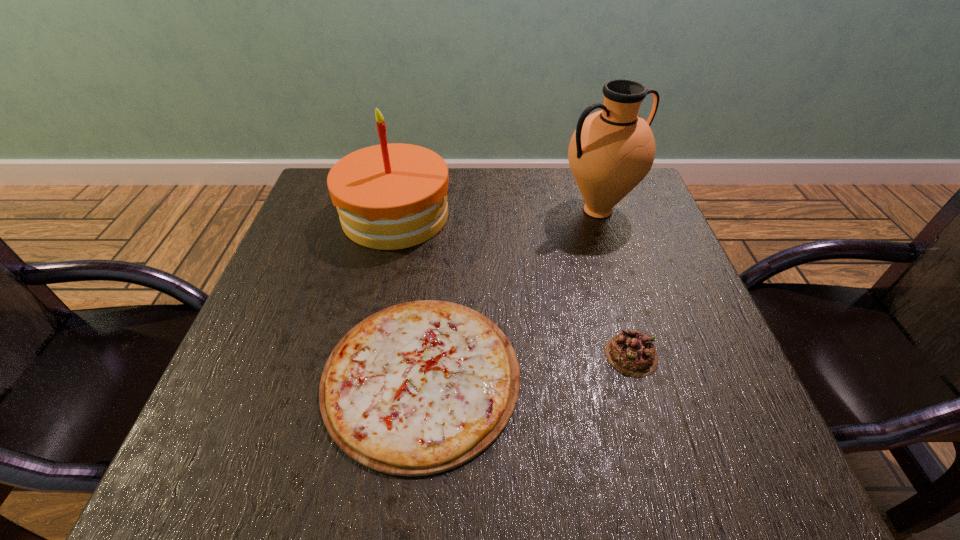
At what (x,y) coordinates should I click in order to perform the action: click on vacant region at the near right corner. Please return your answer as a coordinate pair (x, y). Looking at the image, I should click on (671, 429).

You are a GUI agent. You are given a task and a screenshot of the screen. Output one action in this format:
    pyautogui.click(x=<x>, y=<y>)
    Task: Click on the free spot between the pitcher and the pizza
    The width and height of the screenshot is (960, 540).
    Given the screenshot: What is the action you would take?
    pyautogui.click(x=510, y=293)

You are a GUI agent. You are given a task and a screenshot of the screen. Output one action in this format:
    pyautogui.click(x=<x>, y=<y>)
    Task: Click on the vacant space in between the third tallest object and the birthday cake
    The height and width of the screenshot is (540, 960).
    Given the screenshot: What is the action you would take?
    [x=514, y=285]

Where is `vacant area between the pitcher and the pizza`? The image size is (960, 540). vacant area between the pitcher and the pizza is located at coordinates (510, 293).

At what (x,y) coordinates should I click in order to perform the action: click on free space that is in between the birthday cake and the third tallest object. Please return your answer as a coordinate pair (x, y). The width and height of the screenshot is (960, 540). Looking at the image, I should click on (514, 285).

Find the location of a particular element. unoccupied area between the third tallest object and the pitcher is located at coordinates (614, 283).

You are a GUI agent. You are given a task and a screenshot of the screen. Output one action in this format:
    pyautogui.click(x=<x>, y=<y>)
    Task: Click on the free space that is in between the birthday cake and the pizza
    This screenshot has width=960, height=540.
    Given the screenshot: What is the action you would take?
    pyautogui.click(x=408, y=296)

Where is `empty space between the pitcher and the pizza`? This screenshot has height=540, width=960. empty space between the pitcher and the pizza is located at coordinates (510, 293).

Locate an element on the screen. Image resolution: width=960 pixels, height=540 pixels. free space between the pitcher and the birthday cake is located at coordinates (496, 213).

Where is `empty location between the shortest object and the pitcher`? The width and height of the screenshot is (960, 540). empty location between the shortest object and the pitcher is located at coordinates (510, 293).